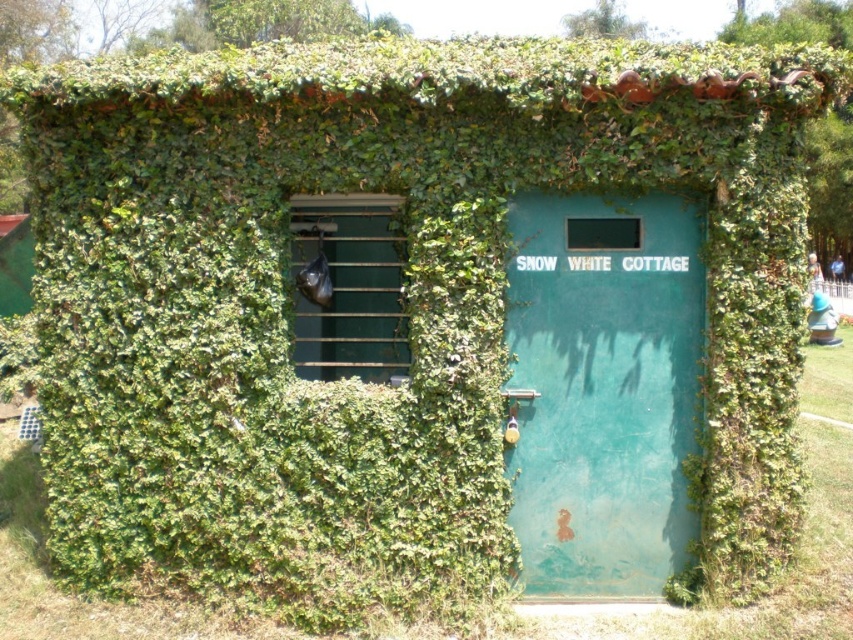
Question: Can you confirm if green matte door at center is bigger than black plastic bag at center?

Choices:
 (A) yes
 (B) no

Answer: (B)

Question: Does green matte door at center have a smaller size compared to transparent plastic bag at center?

Choices:
 (A) no
 (B) yes

Answer: (A)

Question: Which of the following is the closest to the observer?

Choices:
 (A) coord(558,348)
 (B) coord(390,260)
 (C) coord(579,244)

Answer: (A)

Question: Estimate the real-world distances between objects in this image. Which object is closer to the transparent plastic bag at center?

Choices:
 (A) green matte door at center
 (B) black plastic bag at center

Answer: (A)

Question: Which of the following is the closest to the observer?

Choices:
 (A) (567, 237)
 (B) (326, 333)
 (C) (517, 477)

Answer: (A)

Question: Can you confirm if green matte door at center is wider than transparent plastic bag at center?

Choices:
 (A) no
 (B) yes

Answer: (B)